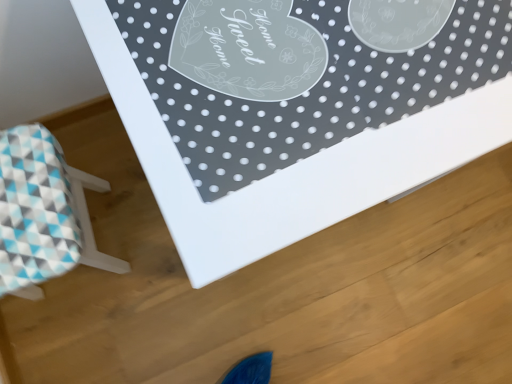
The image size is (512, 384). In order to click on vacant region above white glossy table at upper center (from a real-world perspective) in this screenshot , I will do `click(310, 79)`.